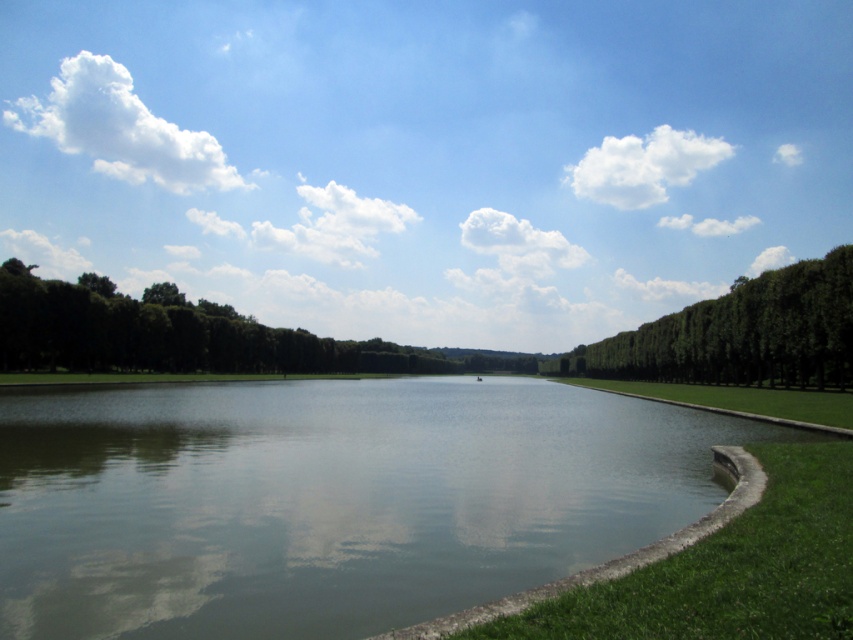
You are standing at the point with coordinates point (693, 305) and want to walk towards the point with coordinates point (167, 506). Based on the scene description, will you have an unobstructed path to reach it?

Yes, you can reach point (167, 506) because it is in front of point (693, 305), indicating no obstructions between them according to the scene description.

You are standing on the concrete curb and see the green grassy lake at center and the green grass at right. Which one is positioned to the left?

The green grassy lake at center is positioned to the left of the green grass at right.

You are standing at the edge of the water in the image. You want to walk to the green grass at right. Which direction should you go relative to the green leafy trees at upper right?

The green grass at right is behind the green leafy trees at upper right, so you should walk towards the direction away from the green leafy trees at upper right to reach the green grass at right.